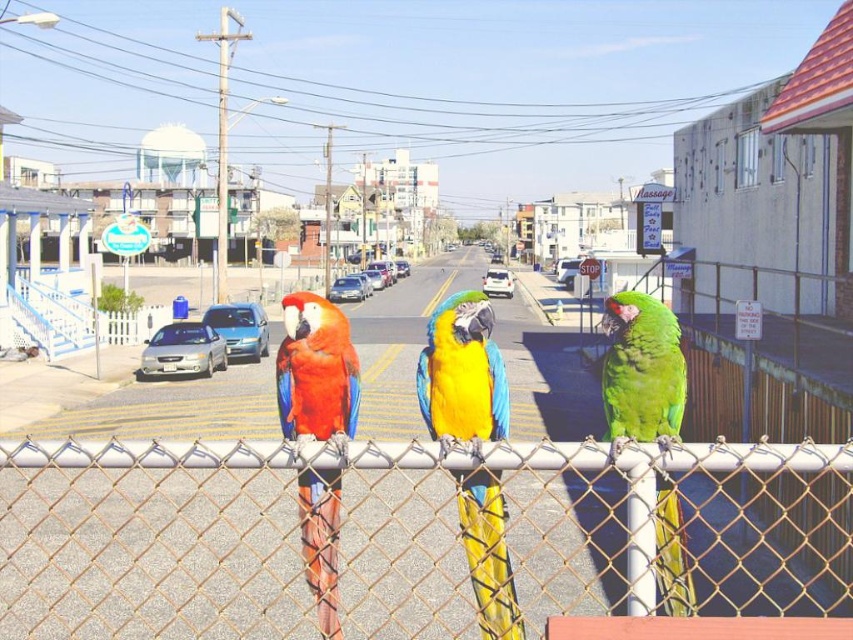
Can you confirm if matte red parrot at center is thinner than green matte parrot at center?

Correct, matte red parrot at center's width is less than green matte parrot at center's.

Does matte red parrot at center appear on the right side of green matte parrot at center?

Incorrect, matte red parrot at center is not on the right side of green matte parrot at center.

The image size is (853, 640). In order to click on matte red parrot at center in this screenshot , I will do `click(316, 372)`.

Between blue-green feathered parrot at center and matte red parrot at center, which one is positioned higher?

matte red parrot at center is higher up.

Does point (486, 356) lie behind point (303, 515)?

Yes, it is.

What do you see at coordinates (462, 374) in the screenshot? I see `blue-green feathered parrot at center` at bounding box center [462, 374].

Where is `blue-green feathered parrot at center`? The height and width of the screenshot is (640, 853). blue-green feathered parrot at center is located at coordinates (462, 374).

Is metal chain-link fence at center below green matte parrot at center?

Indeed, metal chain-link fence at center is positioned under green matte parrot at center.

Is point (281, 440) positioned in front of point (616, 426)?

No.

The width and height of the screenshot is (853, 640). What are the coordinates of `metal chain-link fence at center` in the screenshot? It's located at (412, 536).

Find the location of a particular element. metal chain-link fence at center is located at coordinates (412, 536).